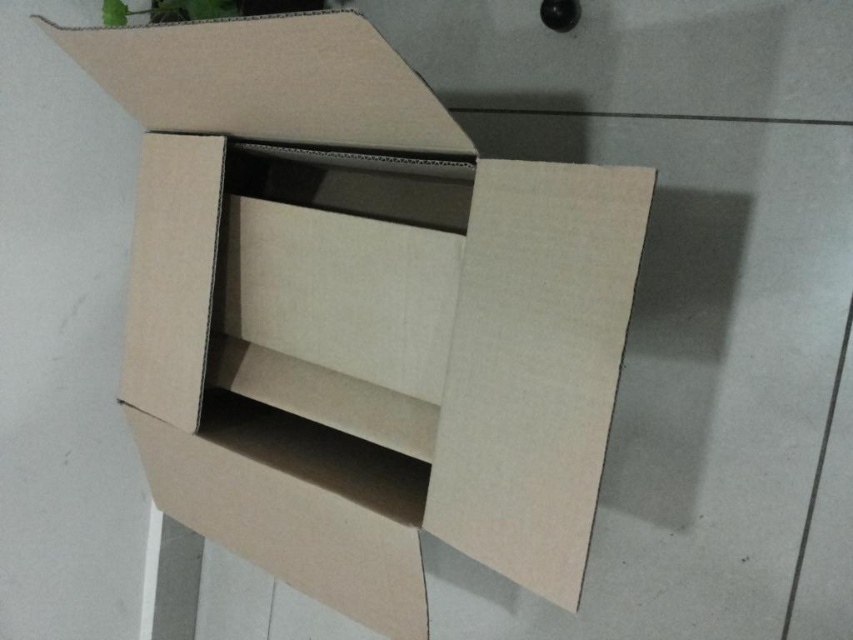
Is brown cardboard box at center to the left of green leafy plant at upper left from the viewer's perspective?

Incorrect, brown cardboard box at center is not on the left side of green leafy plant at upper left.

Can you confirm if brown cardboard box at center is bigger than green leafy plant at upper left?

Correct, brown cardboard box at center is larger in size than green leafy plant at upper left.

Locate an element on the screen. The height and width of the screenshot is (640, 853). brown cardboard box at center is located at coordinates (344, 369).